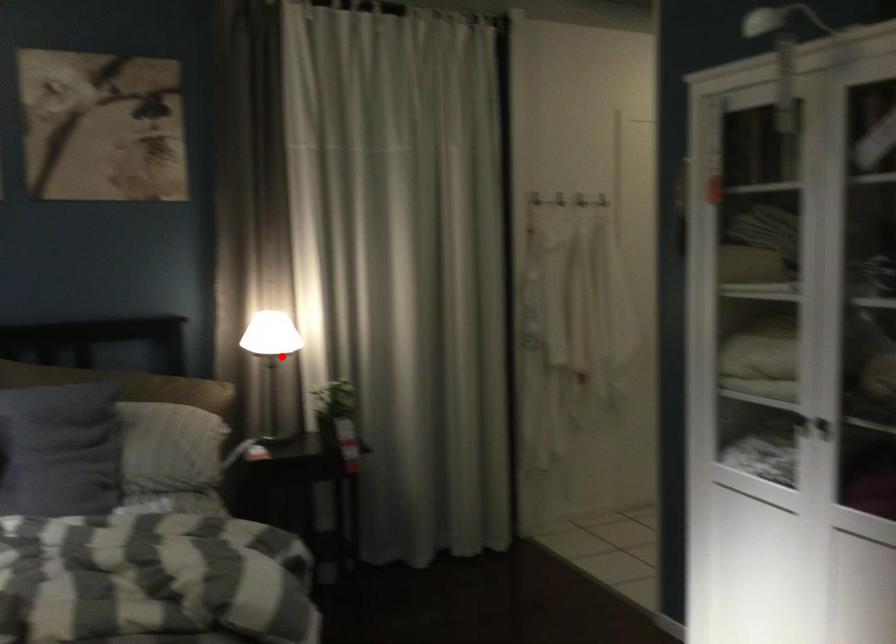
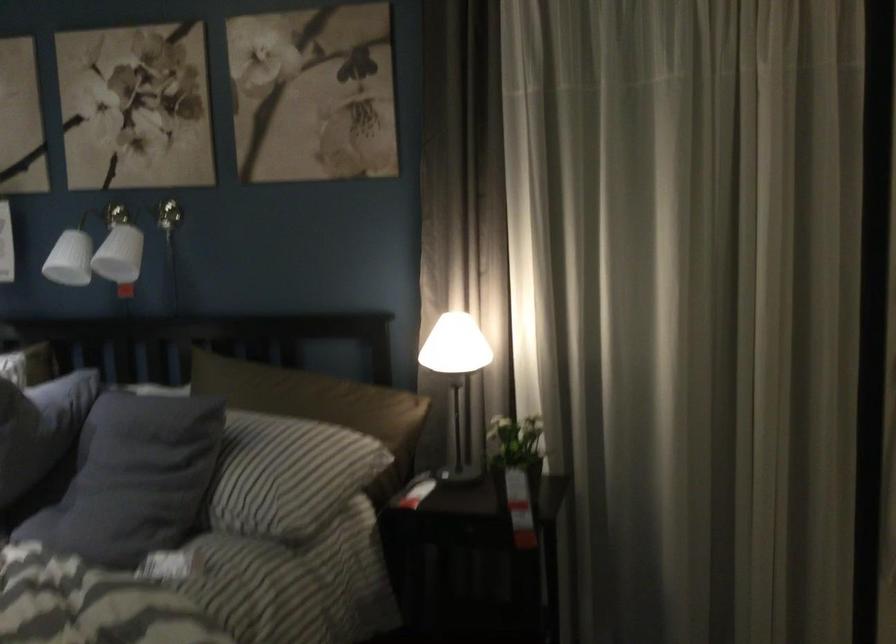
Question: I am providing you with two images of the same scene from different viewpoints. Image1 has a red point marked. In image2, the corresponding 3D location appears at what relative position? Reply with the corresponding letter.

Choices:
 (A) Closer
 (B) Farther

Answer: (A)